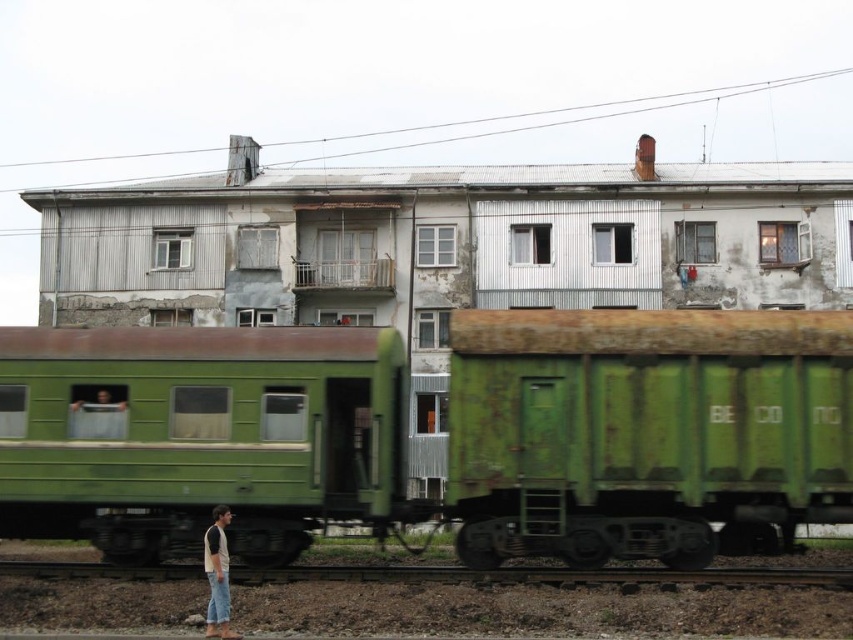
Is point (740, 358) positioned after point (241, 477)?

No, it is not.

Is rusty green metal train car at center above green matte train car at left?

Correct, rusty green metal train car at center is located above green matte train car at left.

Is point (674, 451) farther from viewer compared to point (285, 540)?

No.

Locate an element on the screen. The image size is (853, 640). rusty green metal train car at center is located at coordinates tap(645, 433).

Describe the element at coordinates (645, 433) in the screenshot. I see `rusty green metal train car at center` at that location.

Identify the location of rusty green metal train car at center. (645, 433).

In the scene shown: Who is more forward, (227, 627) or (71, 410)?

Point (227, 627) is more forward.

Does denim jeans at lower left have a greater height compared to smooth green fabric at left?

Correct, denim jeans at lower left is much taller as smooth green fabric at left.

This screenshot has height=640, width=853. In order to click on denim jeans at lower left in this screenshot , I will do [218, 576].